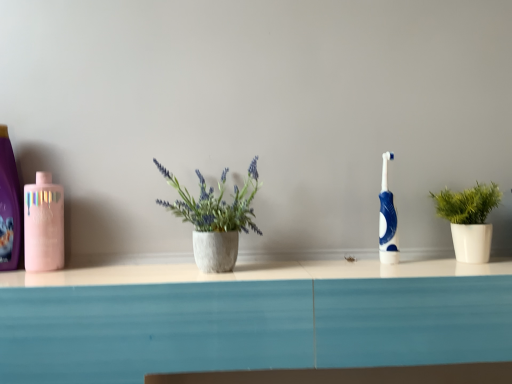
Question: In terms of width, does white matte plant pot at right look wider or thinner when compared to blue glossy toothbrush at center-right?

Choices:
 (A) wide
 (B) thin

Answer: (A)

Question: Is white matte plant pot at right taller or shorter than blue glossy toothbrush at center-right?

Choices:
 (A) tall
 (B) short

Answer: (B)

Question: Considering the real-world distances, which object is closest to the white matte plant pot at right?

Choices:
 (A) matte pink bottle at left
 (B) blue glossy toothbrush at center-right
 (C) pink glossy mouthwash at left

Answer: (B)

Question: Estimate the real-world distances between objects in this image. Which object is farther from the pink glossy mouthwash at left?

Choices:
 (A) matte pink bottle at left
 (B) white matte plant pot at right
 (C) blue glossy toothbrush at center-right

Answer: (B)